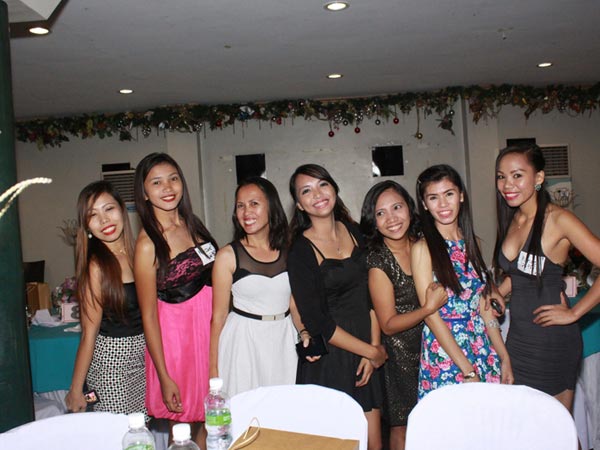
Locate an element on the screen. This screenshot has width=600, height=450. white ceiling is located at coordinates (197, 23).